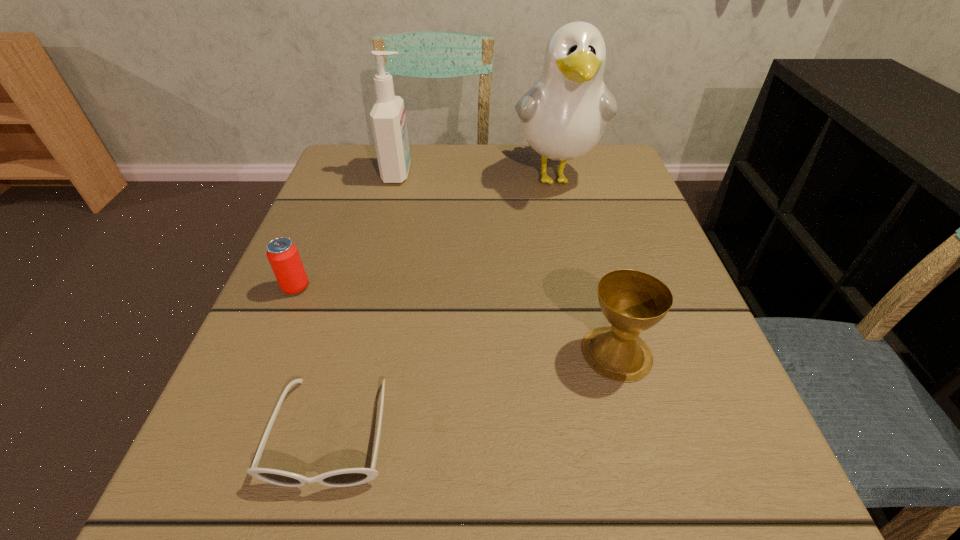
This screenshot has width=960, height=540. I want to click on vacant space that satisfies the following two spatial constraints: 1. on the front label of the second tallest object; 2. on the front side of the third nearest object, so click(x=370, y=287).

You are a GUI agent. You are given a task and a screenshot of the screen. Output one action in this format:
    pyautogui.click(x=<x>, y=<y>)
    Task: Click on the vacant space that satisfies the following two spatial constraints: 1. on the back side of the chalice; 2. on the front label of the cleansing agent
    The width and height of the screenshot is (960, 540).
    Given the screenshot: What is the action you would take?
    pyautogui.click(x=568, y=173)

This screenshot has height=540, width=960. What are the coordinates of `free location that satisfies the following two spatial constraints: 1. on the front label of the fourth shortest object; 2. on the left side of the third shortest object` in the screenshot? It's located at (352, 353).

At what (x,y) coordinates should I click in order to perform the action: click on blank area in the image that satisfies the following two spatial constraints: 1. on the front label of the chalice; 2. on the right side of the second tallest object. Please return your answer as a coordinate pair (x, y). This screenshot has width=960, height=540. Looking at the image, I should click on (352, 353).

The width and height of the screenshot is (960, 540). I want to click on vacant region that satisfies the following two spatial constraints: 1. on the front label of the second tallest object; 2. on the front side of the beer can, so click(x=370, y=287).